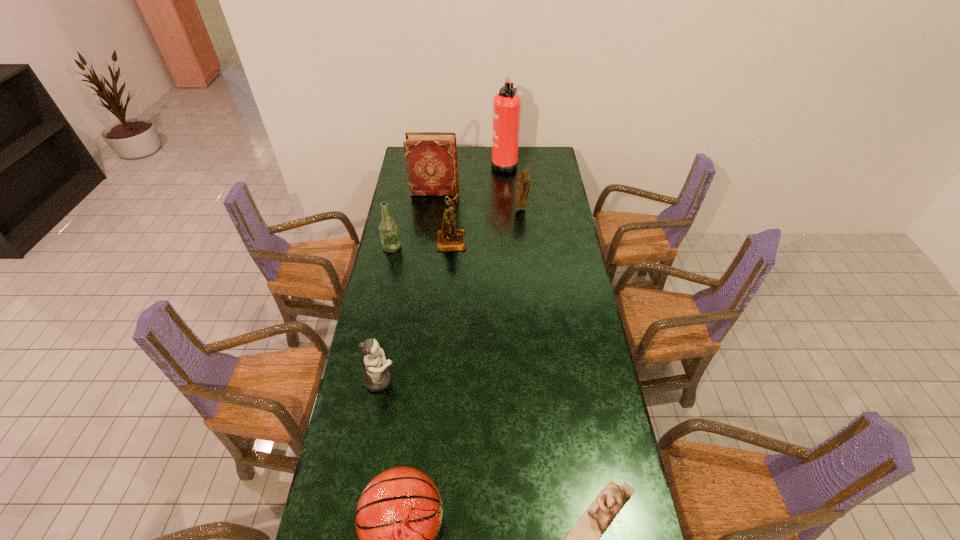
The height and width of the screenshot is (540, 960). Identify the location of the farthest object. (506, 104).

This screenshot has width=960, height=540. Identify the location of fire extinguisher. (506, 104).

You are a GUI agent. You are given a task and a screenshot of the screen. Output one action in this format:
    pyautogui.click(x=<x>, y=<y>)
    Task: Click on the second tallest object
    
    Given the screenshot: What is the action you would take?
    pyautogui.click(x=431, y=157)

Locate an element on the screen. The height and width of the screenshot is (540, 960). the second farthest object is located at coordinates (431, 157).

You are a GUI agent. You are given a task and a screenshot of the screen. Output one action in this format:
    pyautogui.click(x=<x>, y=<y>)
    Task: Click on the second figurine from left to right
    Image resolution: width=960 pixels, height=540 pixels.
    Given the screenshot: What is the action you would take?
    point(449,238)

Find the location of a particular element. The width and height of the screenshot is (960, 540). beer bottle is located at coordinates point(388,229).

Image resolution: width=960 pixels, height=540 pixels. I want to click on the third farthest object, so click(x=523, y=181).

I want to click on the second nearest figurine, so click(x=377, y=377).

Where is `the sixth farthest object`? the sixth farthest object is located at coordinates (377, 377).

I want to click on free location located 0.210m at the nozzle of the farthest object, so click(x=453, y=164).